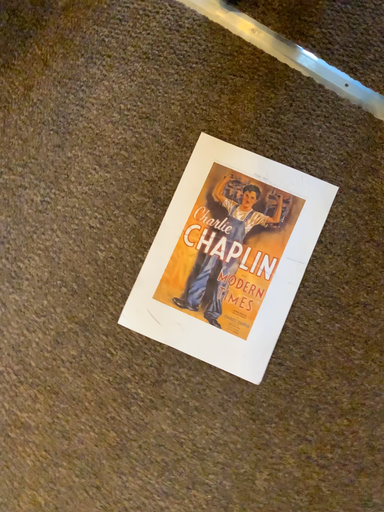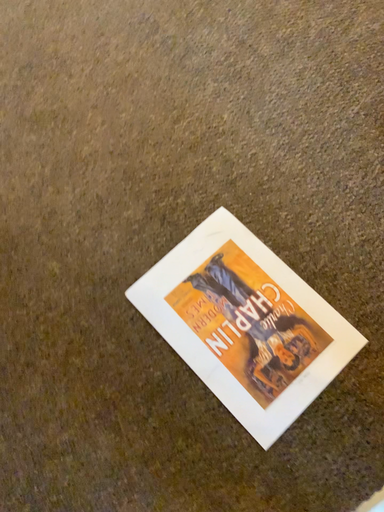
Question: How did the camera likely rotate when shooting the video?

Choices:
 (A) rotated right
 (B) rotated left

Answer: (B)